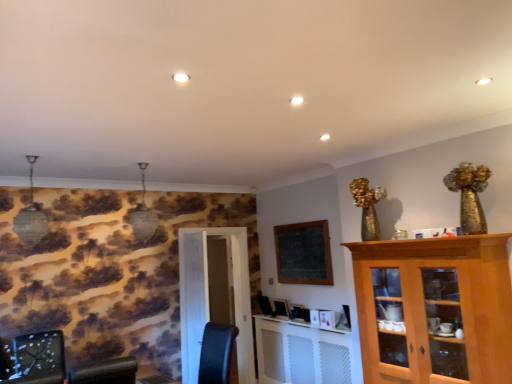
Question: From a real-world perspective, is light brown wooden cabinet at right positioned above or below white glossy door at center?

Choices:
 (A) above
 (B) below

Answer: (A)

Question: Considering the relative positions of light brown wooden cabinet at right and white glossy door at center in the image provided, is light brown wooden cabinet at right to the left or to the right of white glossy door at center?

Choices:
 (A) left
 (B) right

Answer: (B)

Question: Which of these objects is positioned closest to the light brown wooden cabinet at right?

Choices:
 (A) white glossy door at center
 (B) wooden bulletin board at upper center
 (C) white mesh radiator at lower center
 (D) wooden table at lower center

Answer: (C)

Question: Which object is the closest to the wooden bulletin board at upper center?

Choices:
 (A) light brown wooden cabinet at right
 (B) white mesh radiator at lower center
 (C) wooden table at lower center
 (D) white glossy door at center

Answer: (B)